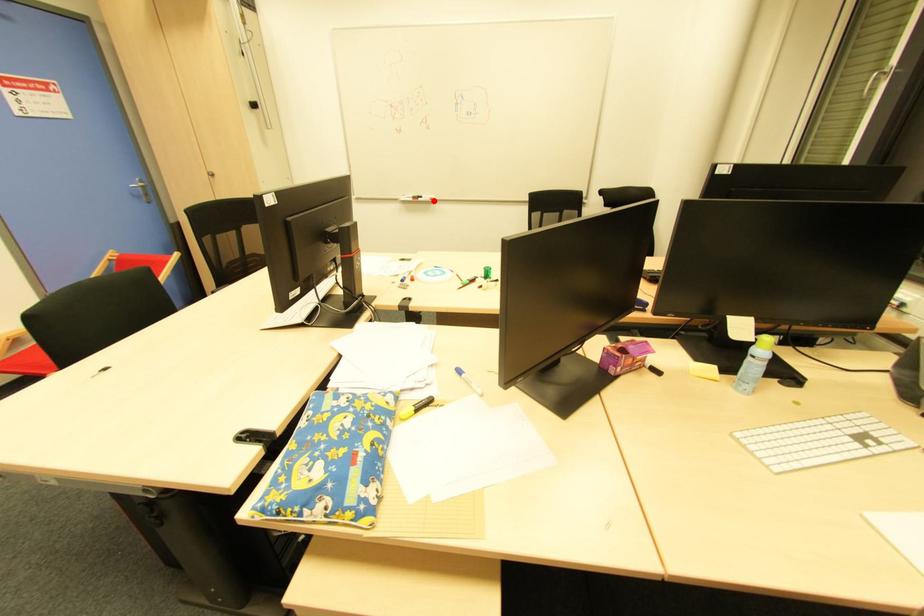
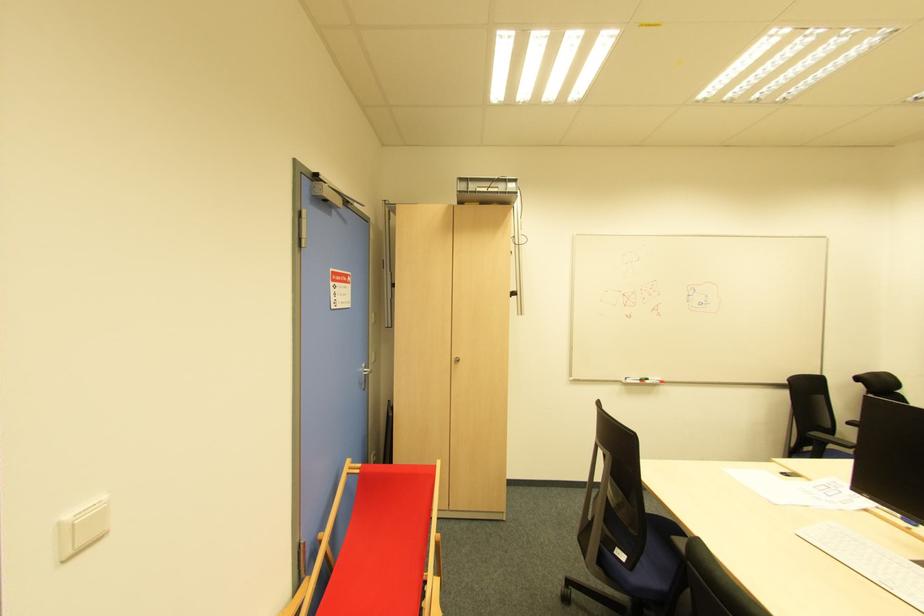
Question: I am providing you with two images of the same scene from different viewpoints. A red point is marked on the first image. Can you still see the location of the red point in image 2?

Choices:
 (A) Yes
 (B) No

Answer: (A)